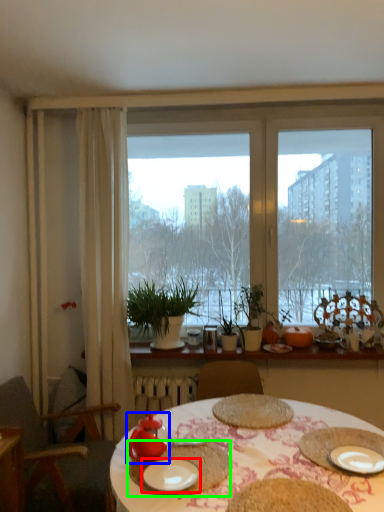
Question: Estimate the real-world distances between objects in this image. Which object is farther from plate (highlighted by a red box), tableware (highlighted by a blue box) or tableware (highlighted by a green box)?

Choices:
 (A) tableware
 (B) tableware

Answer: (A)